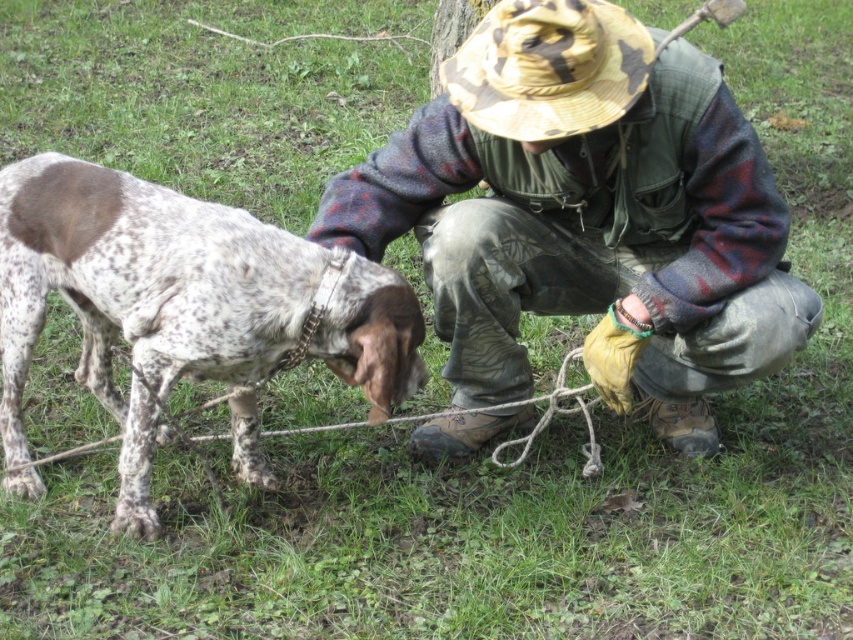
You are a wildlife photographer aiming to capture a closeup of the speckled fur dog at center and the camouflage fabric hat at upper center in the same frame. Given that your camera has a maximum focus range of 35 inches, will you be able to achieve this shot?

The speckled fur dog at center is 35.40 inches from the camouflage fabric hat at upper center. Since the distance exceeds the camera maximum focus range of 35 inches, you won

You are a photographer trying to capture a closeup of the camouflage hat at center and the speckled fur dog at center. Which object should you zoom in on more to ensure both are in focus?

The camouflage hat at center is wider than the speckled fur dog at center. To ensure both are in focus, you should zoom in more on the camouflage hat at center since it is wider and requires a closer focus to capture details without blurring the dog.

You are a wildlife photographer aiming to capture the speckled fur dog at center and the camouflage fabric hat at upper center in a single frame. Based on their sizes, which object will appear bigger in your photo?

The speckled fur dog at center will appear bigger in the photo because it has a larger size compared to the camouflage fabric hat at upper center.